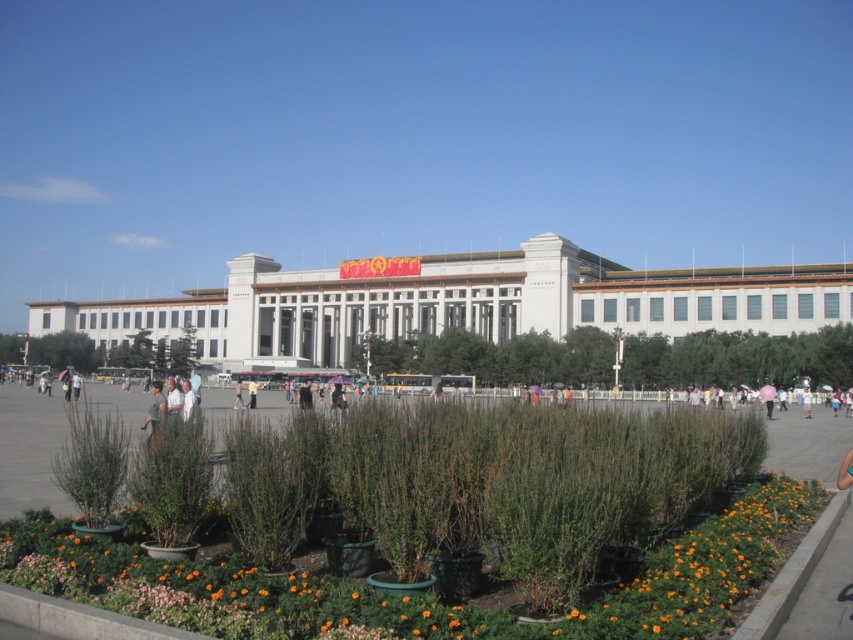
Who is positioned more to the left, white marble building at center or green plastic planters at center?

From the viewer's perspective, white marble building at center appears more on the left side.

Locate an element on the screen. The height and width of the screenshot is (640, 853). white marble building at center is located at coordinates (457, 301).

This screenshot has width=853, height=640. Identify the location of white marble building at center. (457, 301).

Is point (352, 298) positioned in front of point (247, 404)?

That is False.

Does white marble building at center have a smaller size compared to light brown leather jacket at center?

No.

Is point (90, 314) more distant than point (254, 396)?

Yes, point (90, 314) is behind point (254, 396).

This screenshot has height=640, width=853. I want to click on white marble building at center, so click(x=457, y=301).

In the scene shown: Is gray fabric person at center to the left of light brown leather jacket at center from the viewer's perspective?

Indeed, gray fabric person at center is positioned on the left side of light brown leather jacket at center.

Who is positioned more to the right, gray fabric person at center or light brown leather jacket at center?

From the viewer's perspective, light brown leather jacket at center appears more on the right side.

Who is more distant from viewer, (154, 404) or (253, 387)?

The point (253, 387) is behind.

In order to click on gray fabric person at center in this screenshot , I will do `click(155, 406)`.